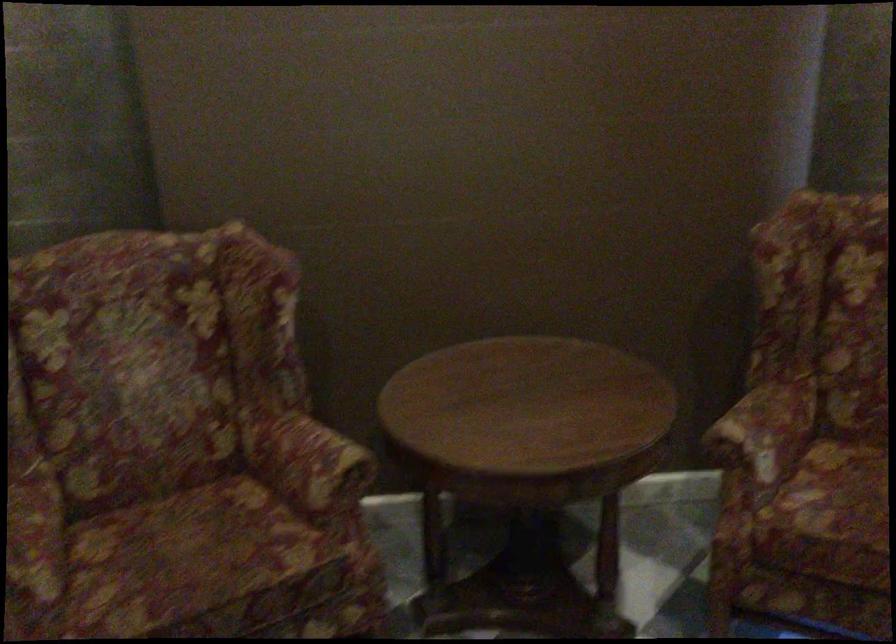
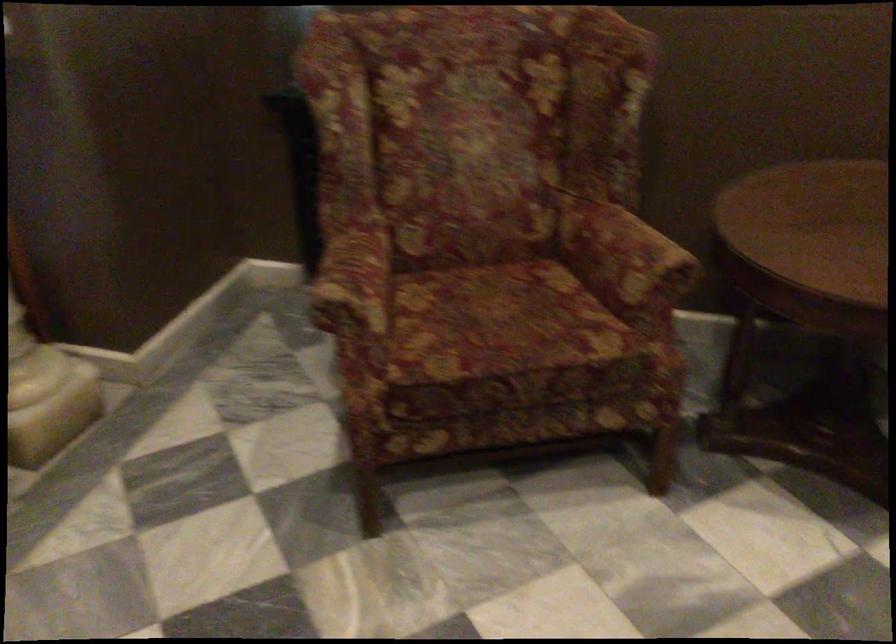
The point at [190,558] is marked in the first image. Where is the corresponding point in the second image?

(501, 323)